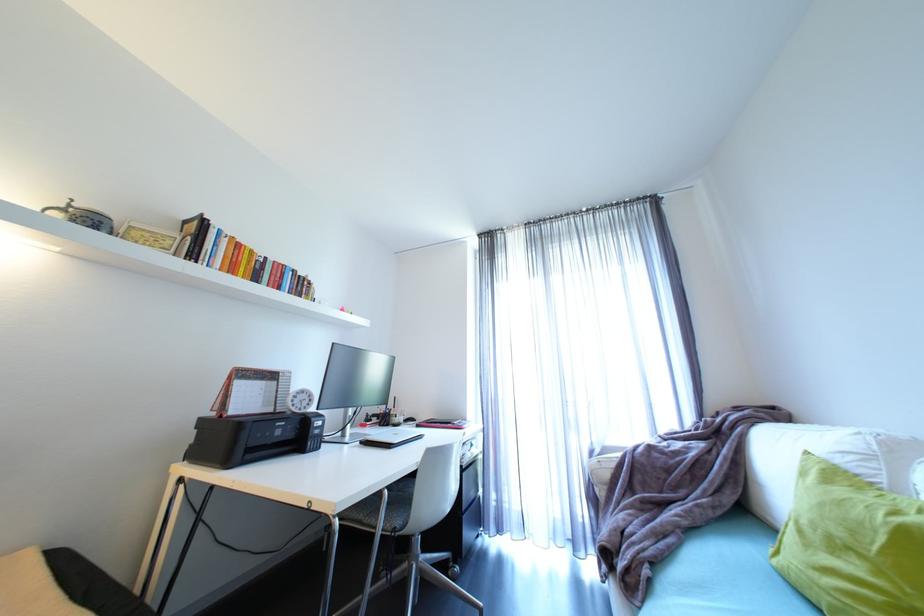
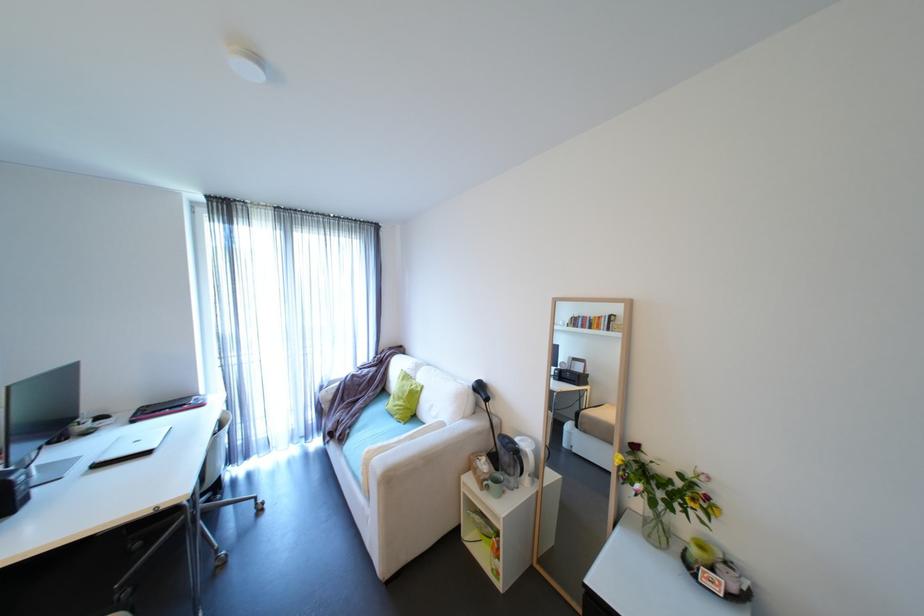
Find the pixel in the second image that matches (487,346) in the first image.

(225, 326)